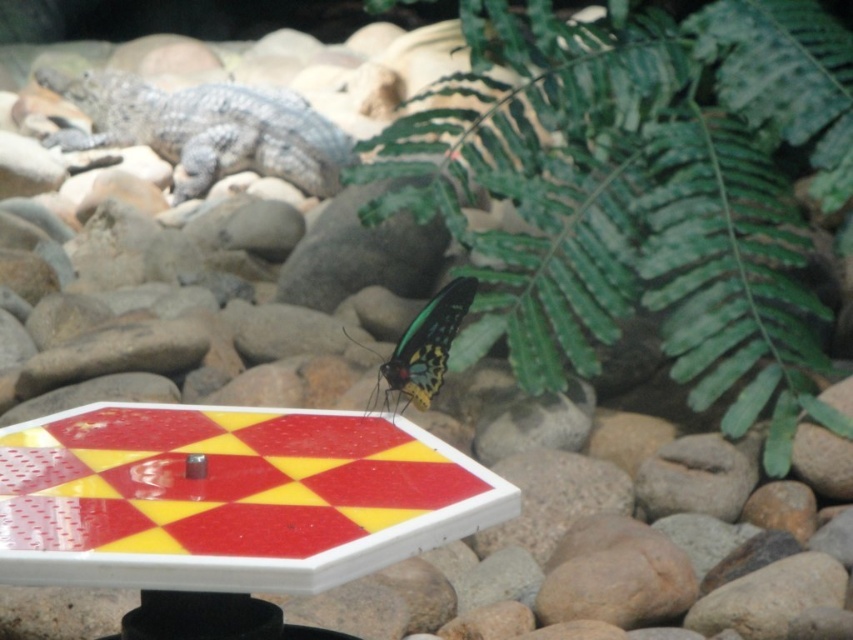
You are standing in the scene and want to place a small decorative item on the table. The table is at the center of your view. Where should you place the item to avoid blocking the view of the green leafy fern at upper right?

The green leafy fern at upper right is located at coordinates point (648, 192), so placing the item away from that area would ensure it doesn not block the view of the green leafy fern at upper right.

You are a photographer taking a picture of the scene. You notice two points in the image at coordinates point (776,289) and point (439,369). Which point is closer to the camera?

Point (776,289) is further to the camera than point (439,369), so point (439,369) is closer to the camera.